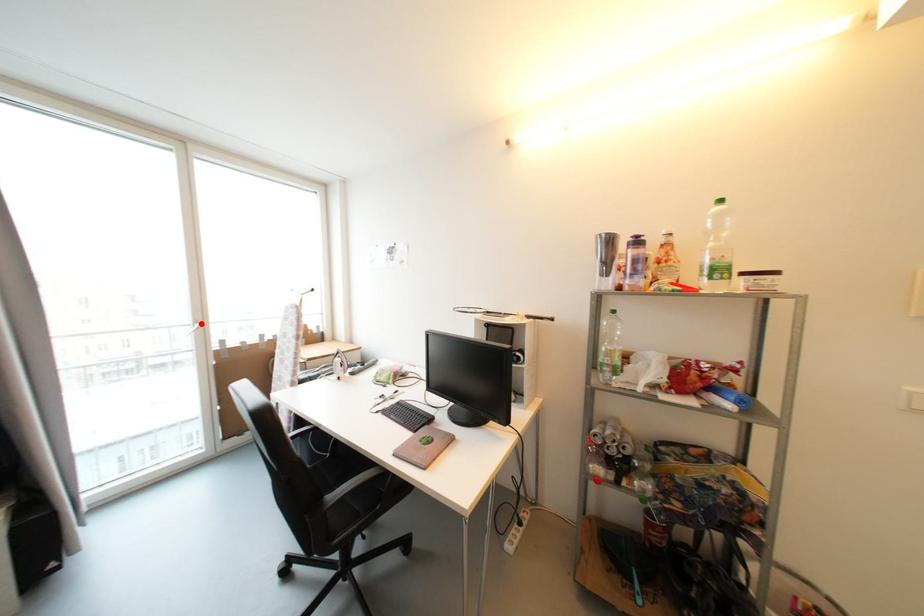
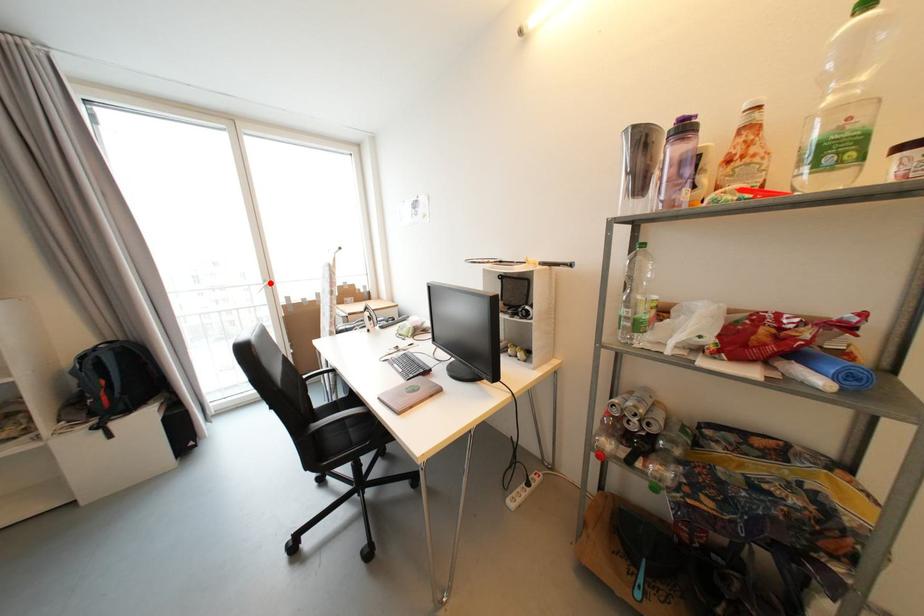
I am providing you with two images of the same scene from different viewpoints. A red point is marked on the first image and another point is marked on the second image. Are the points marked in image1 and image2 representing the same 3D position?

Yes